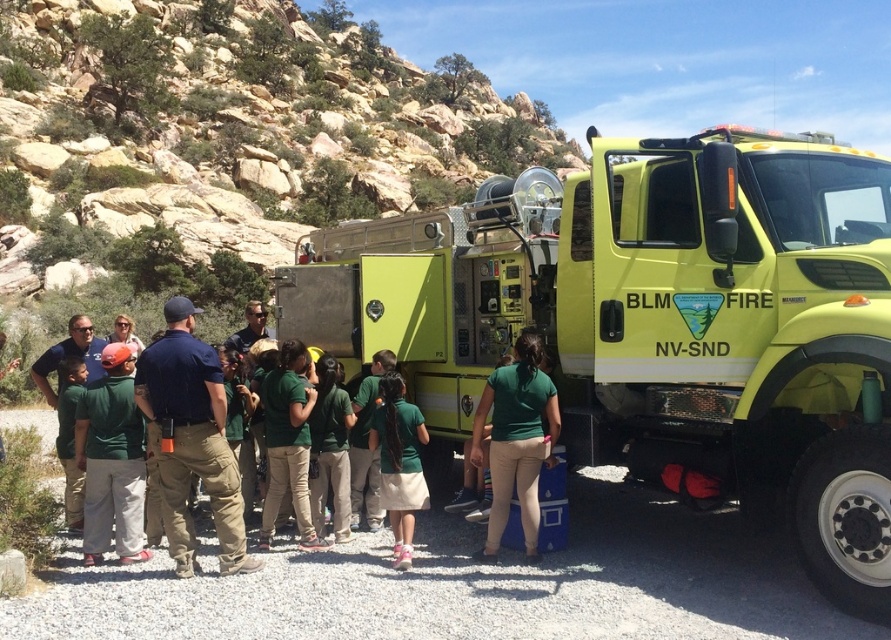
Question: Which object is the closest to the green cotton shirt at center?

Choices:
 (A) green uniform shirt at left
 (B) green fabric shirt at center
 (C) green matte shirt at center

Answer: (A)

Question: Where is camo pants at center located in relation to green fabric shirt at center in the image?

Choices:
 (A) above
 (B) below

Answer: (A)

Question: Can you confirm if matte yellow fire truck at center is smaller than camo pants at center?

Choices:
 (A) yes
 (B) no

Answer: (B)

Question: Where is matte yellow fire truck at center located in relation to camo pants at center in the image?

Choices:
 (A) right
 (B) left

Answer: (B)

Question: Which object appears closest to the camera in this image?

Choices:
 (A) green cotton shirt at center
 (B) green uniform shirt at left

Answer: (A)

Question: Which point is closer to the camera?

Choices:
 (A) (422, 506)
 (B) (481, 394)

Answer: (A)